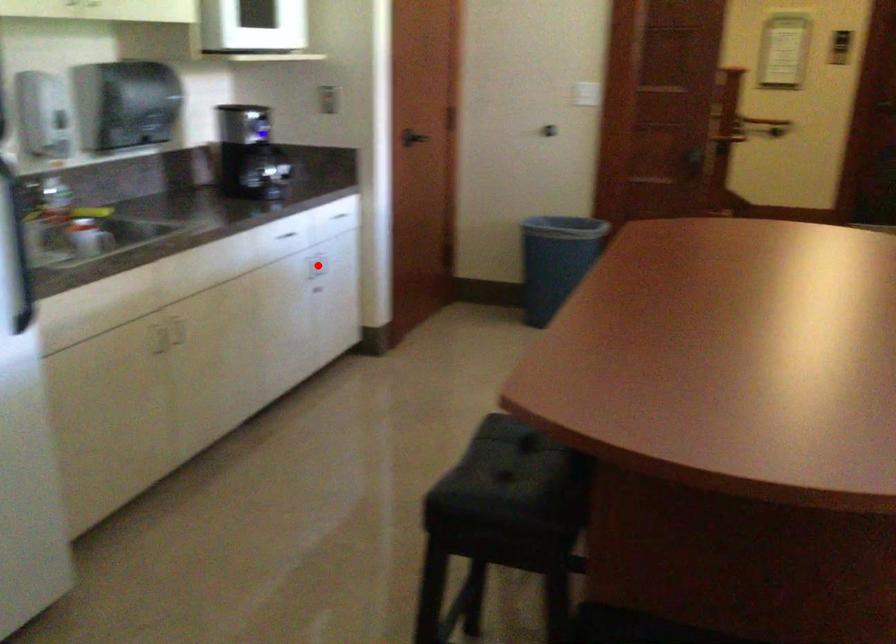
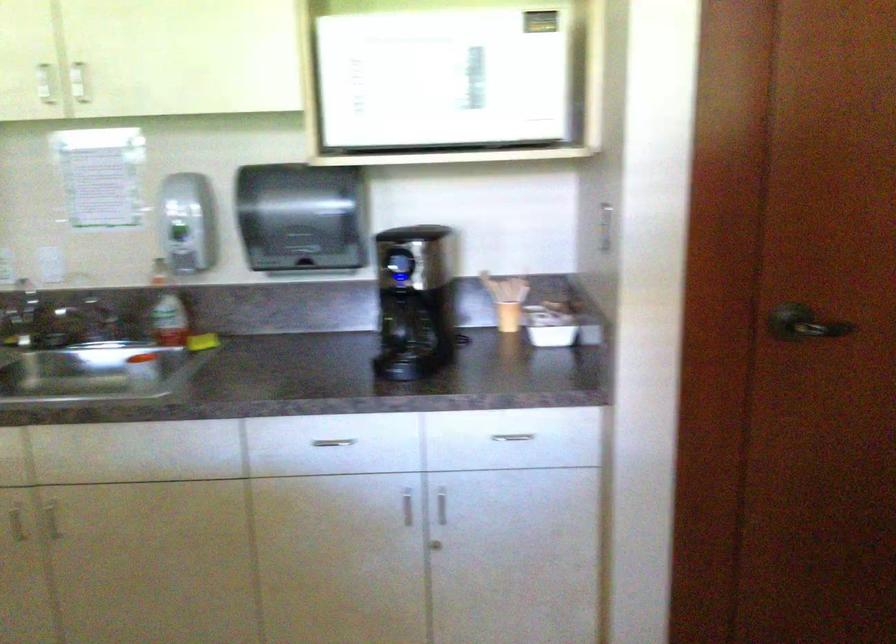
Question: I am providing you with two images of the same scene from different viewpoints. Given a red point in image1, look at the same physical point in image2. Is it:

Choices:
 (A) Closer to the viewpoint
 (B) Farther from the viewpoint

Answer: (A)